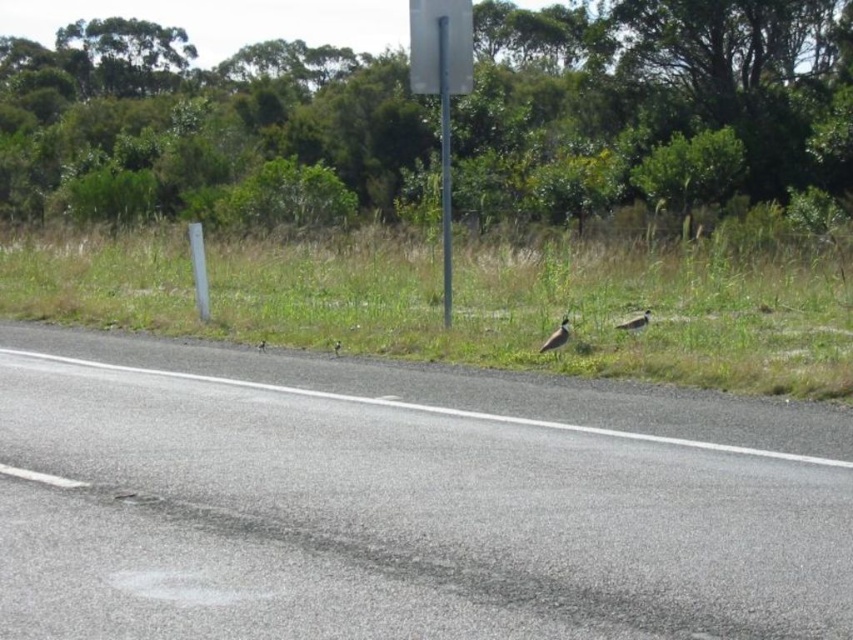
You are standing on the roadside and see the gray asphalt highway at center and the brown speckled feather at center. Which object is nearer to you?

The gray asphalt highway at center is closer to the viewer than the brown speckled feather at center.

You are a bird flying over the gray asphalt highway at center and the brown speckled feather at center. Which object is higher from the ground?

The gray asphalt highway at center is much taller than the brown speckled feather at center, so the gray asphalt highway at center is higher from the ground.